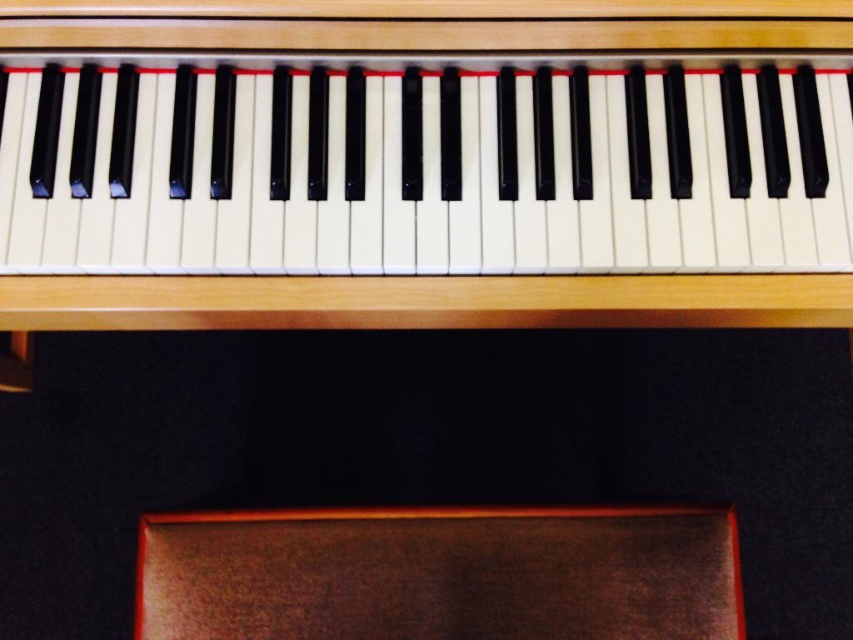
You are sitting on the brown leather stool at lower center and want to reach the matte black piano keys at upper center. Can you easily reach them without moving your seat?

The matte black piano keys at upper center are in front of the brown leather stool at lower center, so they are positioned within easy reach from the stool. Yes, you can easily reach them without moving your seat.

You are a piano teacher observing a student sitting on the brown leather stool at lower center. The student is trying to reach the matte black piano keys at upper center. Based on the size difference between the two objects, can the student comfortably reach the keys?

The matte black piano keys at upper center are larger in size than the brown leather stool at lower center. Since the keys are larger, they are likely positioned within a reachable distance for the student sitting on the stool.